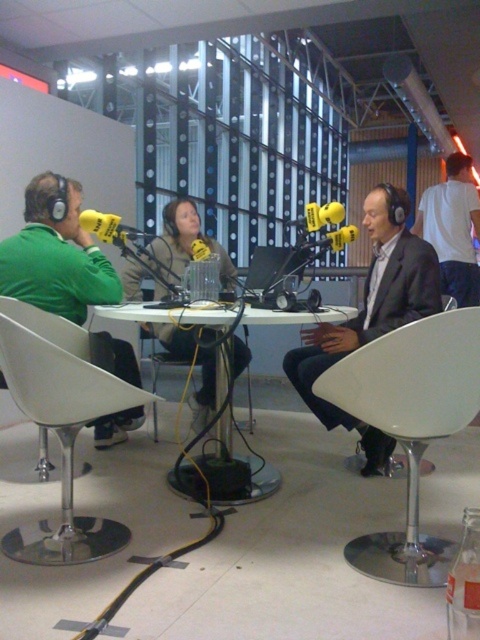
Is white plastic chair at center smaller than matte black suit at center?

Indeed, white plastic chair at center has a smaller size compared to matte black suit at center.

Can you confirm if white plastic chair at center is shorter than matte black suit at center?

Yes.

Which is behind, point (442, 360) or point (436, 266)?

The point (436, 266) is behind.

Identify the location of white plastic chair at center. (409, 426).

What do you see at coordinates (109, 227) in the screenshot? This screenshot has height=640, width=480. I see `yellow matte microphone at left` at bounding box center [109, 227].

Which is below, yellow matte microphone at left or yellow matte microphone at center?

yellow matte microphone at center is below.

This screenshot has width=480, height=640. In order to click on yellow matte microphone at left in this screenshot , I will do `click(109, 227)`.

Locate an element on the screen. This screenshot has height=640, width=480. yellow matte microphone at left is located at coordinates (109, 227).

Can you confirm if white cotton shirt at right is positioned below yellow matte microphone at left?

No, white cotton shirt at right is not below yellow matte microphone at left.

Can you confirm if white cotton shirt at right is positioned above yellow matte microphone at left?

Correct, white cotton shirt at right is located above yellow matte microphone at left.

At what (x,y) coordinates should I click in order to perform the action: click on white cotton shirt at right. Please return your answer as a coordinate pair (x, y). This screenshot has height=640, width=480. Looking at the image, I should click on (453, 228).